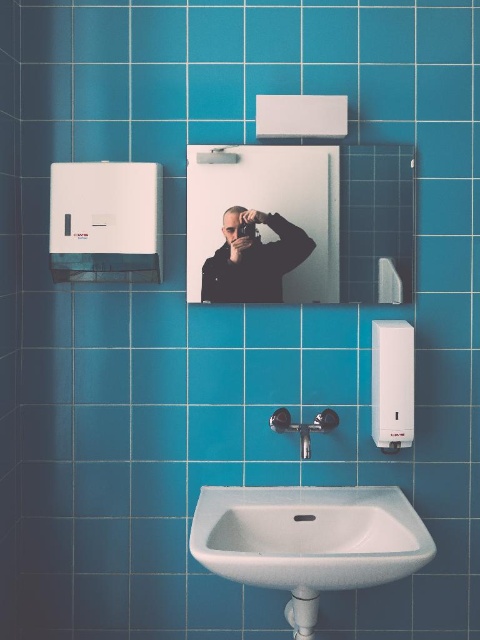
Question: Does clear glass mirror at upper center have a smaller size compared to black matte jacket at center?

Choices:
 (A) yes
 (B) no

Answer: (B)

Question: Estimate the real-world distances between objects in this image. Which object is closer to the clear glass mirror at upper center?

Choices:
 (A) black matte jacket at center
 (B) white ceramic sink at center

Answer: (A)

Question: Is black matte jacket at center smaller than satin nickel faucet at center?

Choices:
 (A) yes
 (B) no

Answer: (A)

Question: Which object is positioned closest to the black matte jacket at center?

Choices:
 (A) white ceramic sink at center
 (B) clear glass mirror at upper center

Answer: (B)

Question: Can you confirm if clear glass mirror at upper center is positioned to the right of satin nickel faucet at center?

Choices:
 (A) no
 (B) yes

Answer: (A)

Question: Which of the following is the farthest from the observer?

Choices:
 (A) (265, 264)
 (B) (236, 536)

Answer: (A)